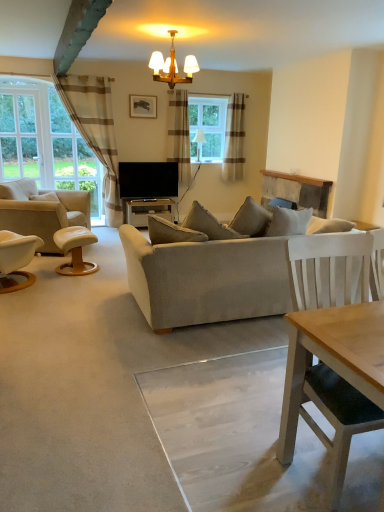
Question: Is brown striped curtain at left, which is the third curtain in right-to-left order, wider than light beige fabric couch at center?

Choices:
 (A) yes
 (B) no

Answer: (B)

Question: Is brown striped curtain at left, which is the 1th curtain in left-to-right order, not close to light beige fabric couch at center?

Choices:
 (A) yes
 (B) no

Answer: (A)

Question: Can you confirm if brown striped curtain at left, which is the 1th curtain in left-to-right order, is thinner than light beige fabric couch at center?

Choices:
 (A) yes
 (B) no

Answer: (A)

Question: From a real-world perspective, does brown striped curtain at left, which is the 1th curtain in left-to-right order, stand above light beige fabric couch at center?

Choices:
 (A) no
 (B) yes

Answer: (B)

Question: From a real-world perspective, is brown striped curtain at left, which is the 1th curtain in left-to-right order, positioned under light beige fabric couch at center based on gravity?

Choices:
 (A) yes
 (B) no

Answer: (B)

Question: Is matte black picture frame at upper center bigger or smaller than beige striped curtain at center, the 3th curtain viewed from the left?

Choices:
 (A) small
 (B) big

Answer: (A)

Question: Is matte black picture frame at upper center inside the boundaries of beige striped curtain at center, which is the 1th curtain in right-to-left order, or outside?

Choices:
 (A) inside
 (B) outside

Answer: (B)

Question: Considering the positions of matte black picture frame at upper center and beige striped curtain at center, which is the 1th curtain in right-to-left order, in the image, is matte black picture frame at upper center taller or shorter than beige striped curtain at center, which is the 1th curtain in right-to-left order,?

Choices:
 (A) tall
 (B) short

Answer: (B)

Question: From the image's perspective, is matte black picture frame at upper center positioned above or below beige striped curtain at center, the 3th curtain viewed from the left?

Choices:
 (A) below
 (B) above

Answer: (B)

Question: Is clear glass window at left inside or outside of black glossy desk at center?

Choices:
 (A) inside
 (B) outside

Answer: (B)

Question: Is point (29, 112) positioned closer to the camera than point (127, 220)?

Choices:
 (A) closer
 (B) farther

Answer: (A)

Question: From the image's perspective, is clear glass window at left positioned above or below black glossy desk at center?

Choices:
 (A) above
 (B) below

Answer: (A)

Question: Is clear glass window at left wider or thinner than black glossy desk at center?

Choices:
 (A) wide
 (B) thin

Answer: (B)

Question: From a real-world perspective, is black glossy desk at center physically located above or below brown striped curtain at left, which is the 1th curtain in left-to-right order?

Choices:
 (A) above
 (B) below

Answer: (B)

Question: Considering the relative positions of black glossy desk at center and brown striped curtain at left, which is the third curtain in right-to-left order, in the image provided, is black glossy desk at center to the left or to the right of brown striped curtain at left, which is the third curtain in right-to-left order,?

Choices:
 (A) left
 (B) right

Answer: (B)